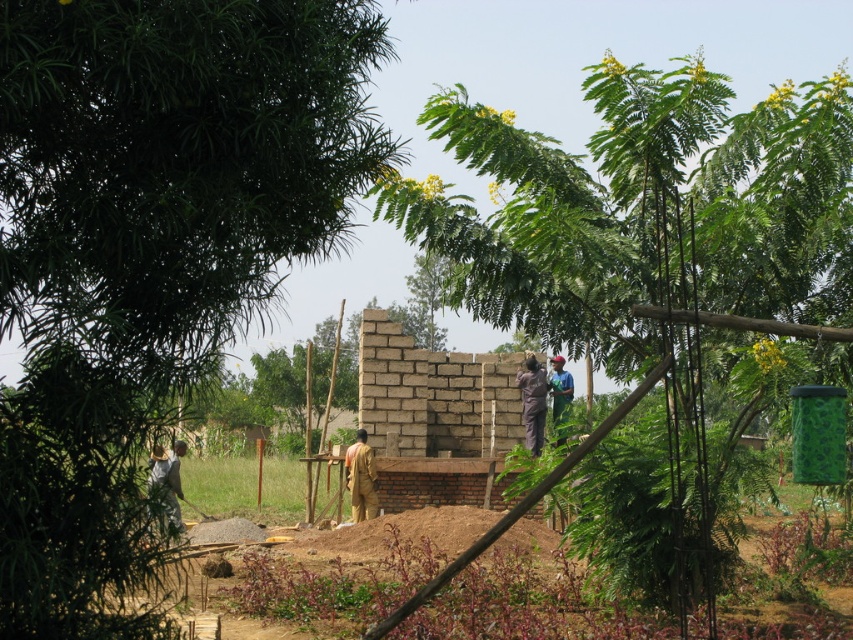
Question: Which of the following is the closest to the observer?

Choices:
 (A) brown fabric construction worker at center
 (B) brown fabric at center

Answer: (A)

Question: Which is nearer to the light brown fabric shirt at lower left?

Choices:
 (A) brown fabric at center
 (B) green leafy tree at upper left
 (C) brown soil at lower center
 (D) green leafy tree at center

Answer: (B)

Question: Among these points, which one is farthest from the camera?

Choices:
 (A) (364, 456)
 (B) (550, 394)

Answer: (B)

Question: Is brown fabric at center above dark blue shirt at center?

Choices:
 (A) no
 (B) yes

Answer: (B)

Question: In this image, where is green leafy tree at upper left located relative to brown soil at lower center?

Choices:
 (A) left
 (B) right

Answer: (A)

Question: Is green leafy tree at upper left to the right of brown fabric construction worker at center from the viewer's perspective?

Choices:
 (A) no
 (B) yes

Answer: (B)